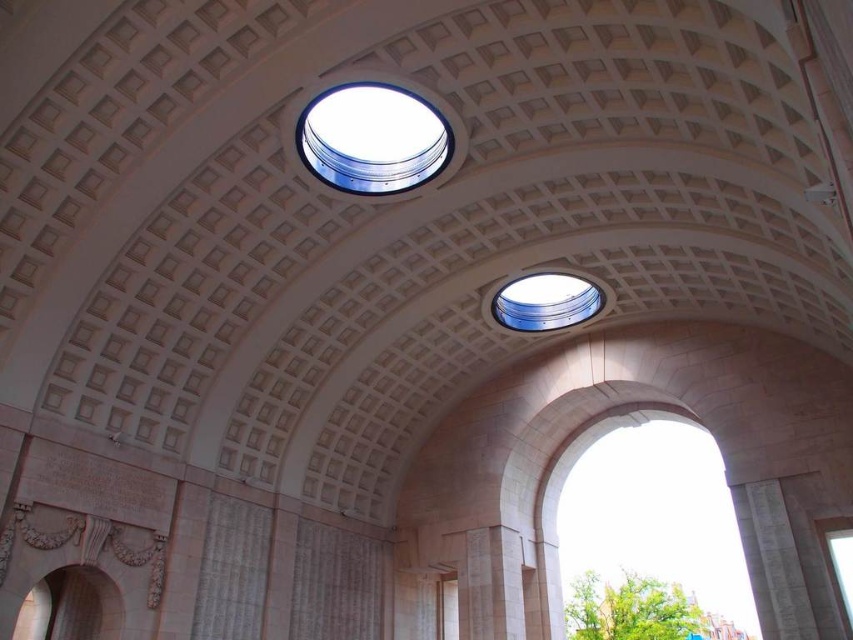
Question: Can you confirm if clear glass dome at upper center is thinner than transparent glass window at center?

Choices:
 (A) yes
 (B) no

Answer: (A)

Question: Does clear glass dome at upper center appear over transparent glass window at center?

Choices:
 (A) no
 (B) yes

Answer: (B)

Question: Can you confirm if clear glass dome at upper center is smaller than transparent glass window at center?

Choices:
 (A) yes
 (B) no

Answer: (A)

Question: Which of the following is the farthest from the observer?

Choices:
 (A) (579, 305)
 (B) (424, 106)

Answer: (A)